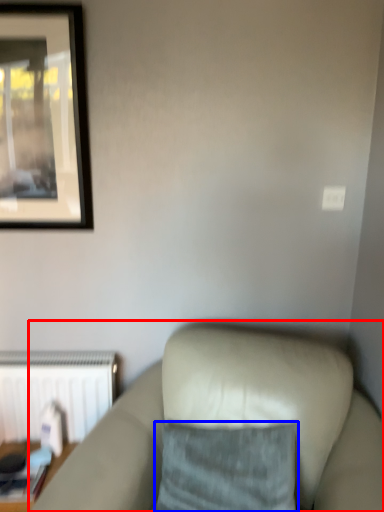
Question: Which object is closer to the camera taking this photo, studio couch (highlighted by a red box) or pillow (highlighted by a blue box)?

Choices:
 (A) studio couch
 (B) pillow

Answer: (A)